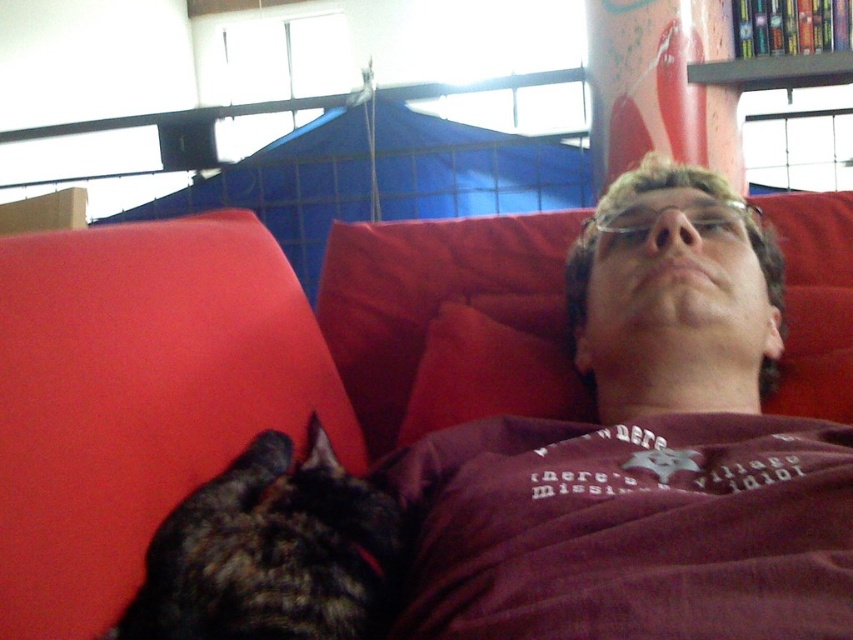
You are an interior designer planning to place a new lamp on the red fabric couch at upper center. According to the coordinates provided, where exactly should you place the lamp?

The red fabric couch at upper center is located at coordinates point (68, 397), so place the lamp there.

You are a visitor in this room and want to place a small plant on the nearest object to you. Which object should you choose between the red fabric couch at upper center and the pink wood bookshelf at upper right?

The red fabric couch at upper center is closer to the viewer than the pink wood bookshelf at upper right, so you should place the plant on the red fabric couch at upper center.

You are a photographer standing in front of the red fabric couch at upper center. You want to take a closeup photo of the couch, but you need to be exactly 20 inches away to get the right framing. Can you move closer or farther away to achieve this?

The red fabric couch at upper center is currently 21.07 inches away from the camera. To get the desired 20 inches distance, you need to move closer by approximately 1.07 inches.